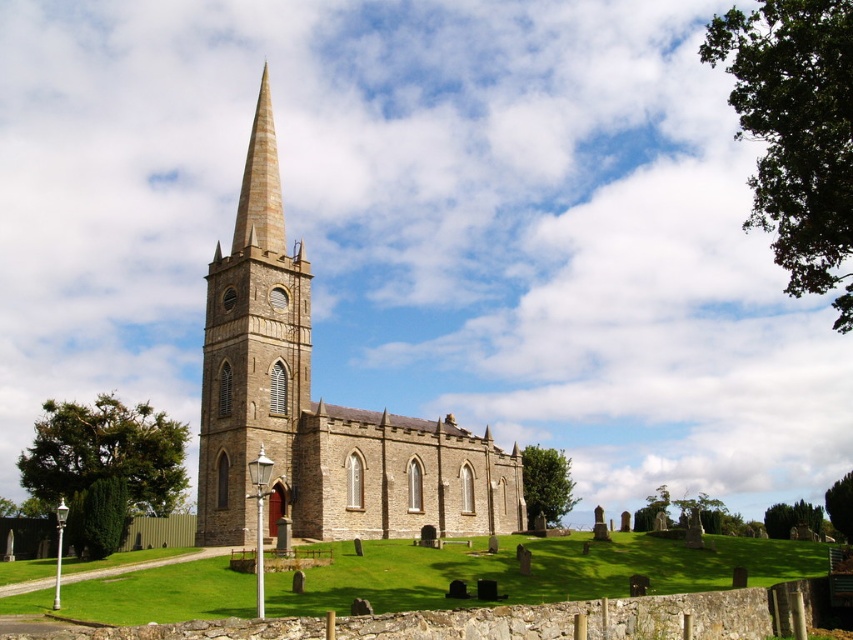
Question: Which of the following is the farthest from the observer?

Choices:
 (A) yellow striped stone spire at center
 (B) brown stone church at center
 (C) brown stone steeple at center

Answer: (A)

Question: Estimate the real-world distances between objects in this image. Which object is closer to the brown stone church at center?

Choices:
 (A) brown stone steeple at center
 (B) yellow striped stone spire at center

Answer: (A)

Question: Is brown stone steeple at center above yellow striped stone spire at center?

Choices:
 (A) no
 (B) yes

Answer: (A)

Question: Is brown stone church at center smaller than yellow striped stone spire at center?

Choices:
 (A) no
 (B) yes

Answer: (A)

Question: Which object appears farthest from the camera in this image?

Choices:
 (A) brown stone church at center
 (B) yellow striped stone spire at center

Answer: (B)

Question: Where is brown stone church at center located in relation to brown stone steeple at center in the image?

Choices:
 (A) above
 (B) below

Answer: (B)